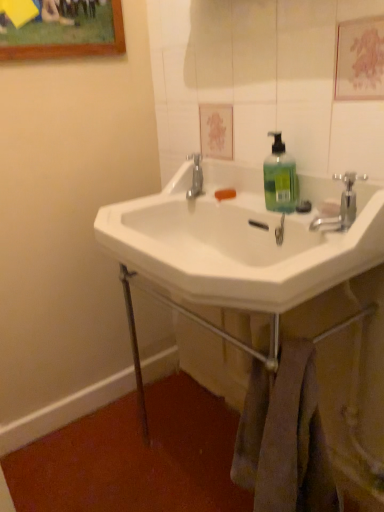
Question: Is white glossy mirror at upper center taller than chrome metallic faucet at upper right?

Choices:
 (A) no
 (B) yes

Answer: (B)

Question: Considering the relative sizes of white glossy mirror at upper center and chrome metallic faucet at upper right in the image provided, is white glossy mirror at upper center smaller than chrome metallic faucet at upper right?

Choices:
 (A) yes
 (B) no

Answer: (B)

Question: Does white glossy mirror at upper center have a lesser width compared to chrome metallic faucet at upper right?

Choices:
 (A) no
 (B) yes

Answer: (B)

Question: From a real-world perspective, is white glossy mirror at upper center located beneath chrome metallic faucet at upper right?

Choices:
 (A) no
 (B) yes

Answer: (A)

Question: Is white glossy mirror at upper center further to the viewer compared to chrome metallic faucet at upper right?

Choices:
 (A) yes
 (B) no

Answer: (B)

Question: In terms of size, does white ceramic sink at center appear bigger or smaller than green translucent liquid at center?

Choices:
 (A) small
 (B) big

Answer: (B)

Question: Considering the positions of white ceramic sink at center and green translucent liquid at center in the image, is white ceramic sink at center wider or thinner than green translucent liquid at center?

Choices:
 (A) thin
 (B) wide

Answer: (B)

Question: In the image, is white ceramic sink at center positioned in front of or behind green translucent liquid at center?

Choices:
 (A) behind
 (B) front

Answer: (B)

Question: Would you say white ceramic sink at center is inside or outside green translucent liquid at center?

Choices:
 (A) outside
 (B) inside

Answer: (A)

Question: Which is correct: white ceramic sink at center is inside white glossy mirror at upper center, or outside of it?

Choices:
 (A) outside
 (B) inside

Answer: (A)

Question: Is white ceramic sink at center in front of or behind white glossy mirror at upper center in the image?

Choices:
 (A) behind
 (B) front

Answer: (A)

Question: Is white ceramic sink at center bigger or smaller than white glossy mirror at upper center?

Choices:
 (A) big
 (B) small

Answer: (A)

Question: From a real-world perspective, is white ceramic sink at center above or below white glossy mirror at upper center?

Choices:
 (A) below
 (B) above

Answer: (A)

Question: Is point (170, 186) closer or farther from the camera than point (365, 283)?

Choices:
 (A) closer
 (B) farther

Answer: (B)

Question: Do you think white ceramic sink at center is within white ceramic sink at center, or outside of it?

Choices:
 (A) outside
 (B) inside

Answer: (A)